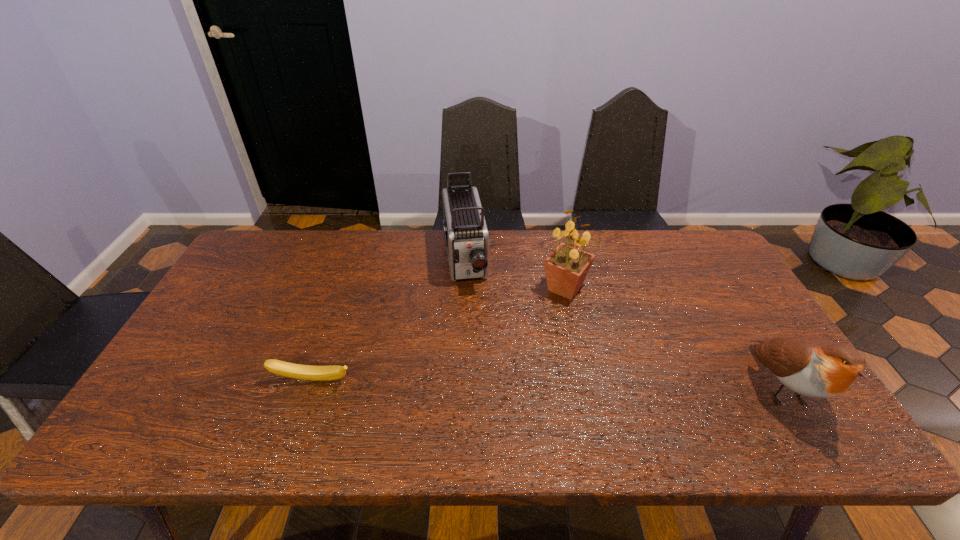
Identify the location of vacant space on the desktop that is between the shortest object and the rightmost object and is positioned at the front of the sunflower with flowers visible. (614, 384).

At what (x,y) coordinates should I click in order to perform the action: click on vacant space on the desktop that is between the leftmost object and the bird and is positioned at the lens of the camcorder. Please return your answer as a coordinate pair (x, y). The width and height of the screenshot is (960, 540). Looking at the image, I should click on (487, 383).